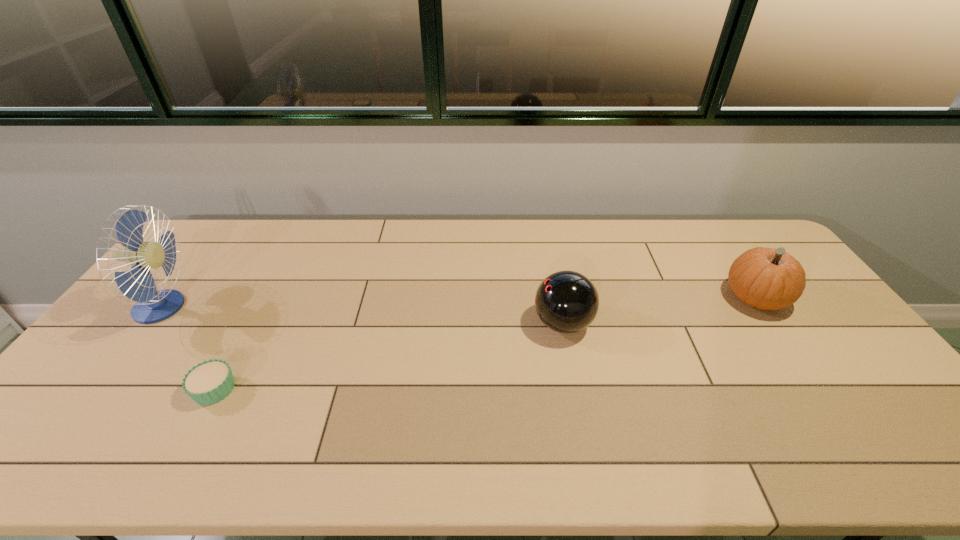
Where is `free space located on the stem of the rightmost object`? free space located on the stem of the rightmost object is located at coordinates (701, 298).

You are a GUI agent. You are given a task and a screenshot of the screen. Output one action in this format:
    pyautogui.click(x=<x>, y=<y>)
    Task: Click on the vacant space positioned 0.130m on the stem of the rightmost object
    Image resolution: width=960 pixels, height=540 pixels.
    Given the screenshot: What is the action you would take?
    pyautogui.click(x=682, y=298)

Locate an element on the screen. vacant point located on the surface of the bowling ball near the finger holes is located at coordinates (502, 323).

Where is `vacant space located 0.350m on the surface of the bowling ball near the finger holes`? The image size is (960, 540). vacant space located 0.350m on the surface of the bowling ball near the finger holes is located at coordinates (413, 323).

Locate an element on the screen. Image resolution: width=960 pixels, height=540 pixels. vacant space situated on the surface of the bowling ball near the finger holes is located at coordinates (498, 323).

What are the coordinates of `free space located on the back of the cupcake` in the screenshot? It's located at (244, 334).

The width and height of the screenshot is (960, 540). Identify the location of object at the left edge. (151, 306).

Where is `object that is at the right edge`? The width and height of the screenshot is (960, 540). object that is at the right edge is located at coordinates (764, 278).

Image resolution: width=960 pixels, height=540 pixels. What are the coordinates of `free point at the far edge` in the screenshot? It's located at (468, 226).

Where is `vacant region at the near edge of the desktop`? This screenshot has width=960, height=540. vacant region at the near edge of the desktop is located at coordinates (675, 441).